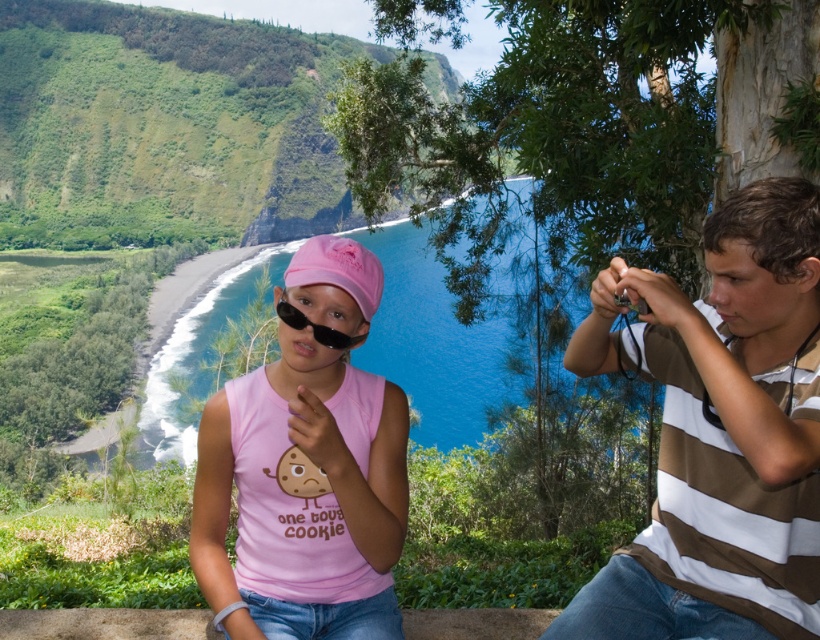
Question: Is pink fabric shirt at center above black matte goggles at center?

Choices:
 (A) yes
 (B) no

Answer: (B)

Question: Does pink fabric shirt at center lie in front of pink matte tank top at center?

Choices:
 (A) no
 (B) yes

Answer: (B)

Question: Among these points, which one is farthest from the camera?

Choices:
 (A) (773, 580)
 (B) (376, 378)
 (C) (333, 346)

Answer: (B)

Question: Can you confirm if pink fabric shirt at center is bigger than pink matte tank top at center?

Choices:
 (A) no
 (B) yes

Answer: (B)

Question: Estimate the real-world distances between objects in this image. Which object is closer to the pink matte tank top at center?

Choices:
 (A) pink fabric shirt at center
 (B) black matte goggles at center

Answer: (B)

Question: Which point is closer to the camera?

Choices:
 (A) (796, 257)
 (B) (324, 340)

Answer: (A)